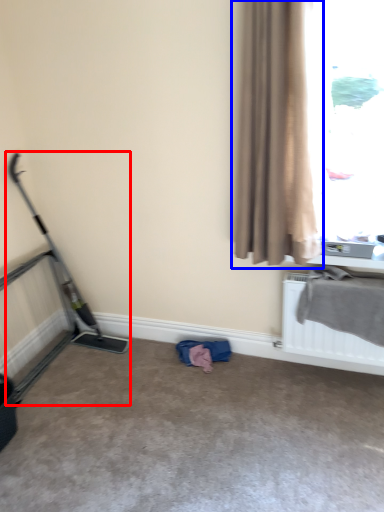
Question: Among these objects, which one is nearest to the camera, baby carriage (highlighted by a red box) or curtain (highlighted by a blue box)?

Choices:
 (A) baby carriage
 (B) curtain

Answer: (B)